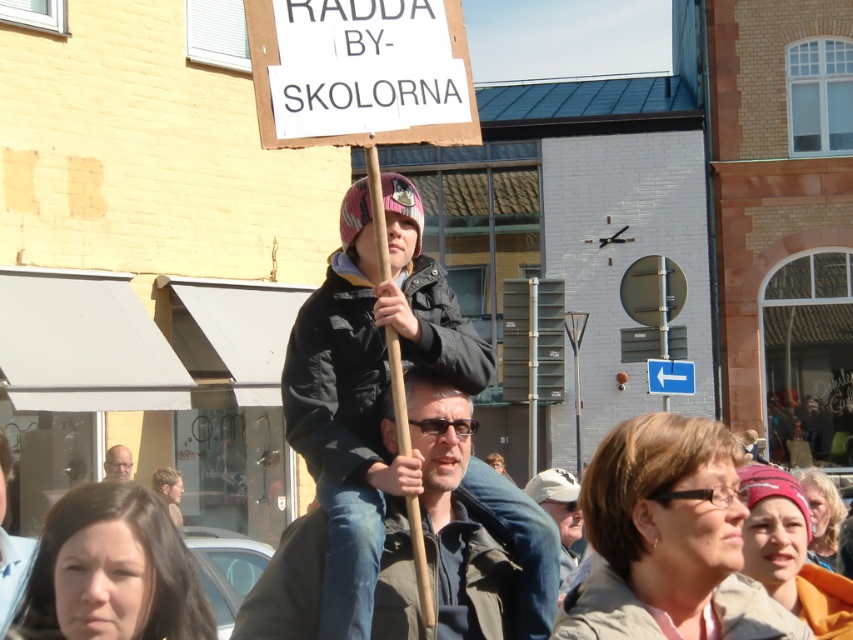
Is dark green jacket at center to the left of matte black glasses at lower left from the viewer's perspective?

No, dark green jacket at center is not to the left of matte black glasses at lower left.

Which of these two, dark green jacket at center or matte black glasses at lower left, stands taller?

dark green jacket at center

Locate an element on the screen. This screenshot has height=640, width=853. dark green jacket at center is located at coordinates (457, 516).

Is point (267, 636) less distant than point (9, 618)?

No, (267, 636) is behind (9, 618).

Does dark green jacket at center lie behind light brown leather jacket at lower left?

Yes.

What do you see at coordinates (457, 516) in the screenshot? The width and height of the screenshot is (853, 640). I see `dark green jacket at center` at bounding box center [457, 516].

This screenshot has height=640, width=853. I want to click on dark green jacket at center, so click(457, 516).

Can you confirm if light brown leather jacket at lower left is bigger than matte black glasses at lower left?

Indeed, light brown leather jacket at lower left has a larger size compared to matte black glasses at lower left.

Who is lower down, light brown leather jacket at lower left or matte black glasses at lower left?

Positioned lower is matte black glasses at lower left.

Locate an element on the screen. The height and width of the screenshot is (640, 853). light brown leather jacket at lower left is located at coordinates (9, 547).

Identify the location of light brown leather jacket at lower left. The width and height of the screenshot is (853, 640). (9, 547).